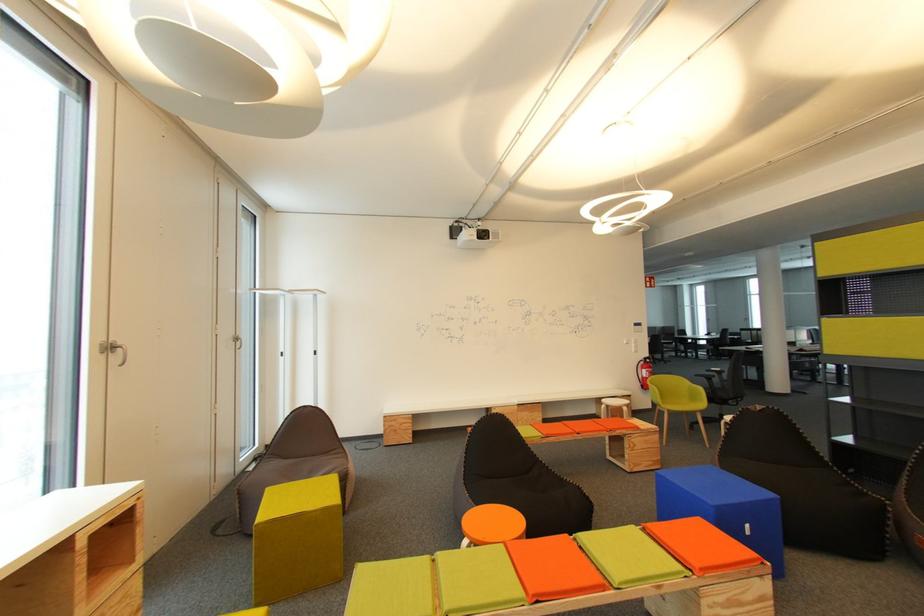
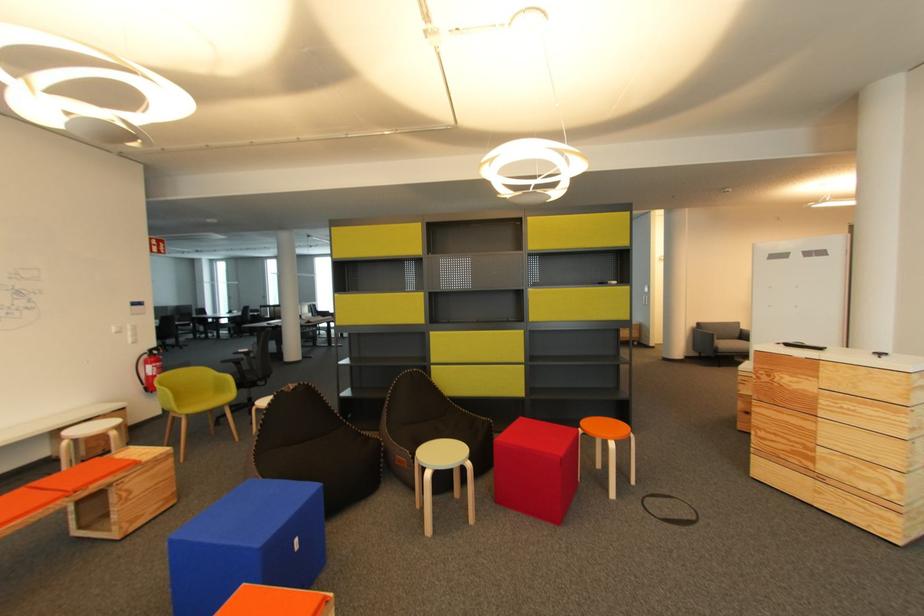
Question: The camera is either moving clockwise (left) or counter-clockwise (right) around the object. The first image is from the beginning of the video and the second image is from the end. Is the camera moving left or right when shooting the video?

Choices:
 (A) Left
 (B) Right

Answer: (A)